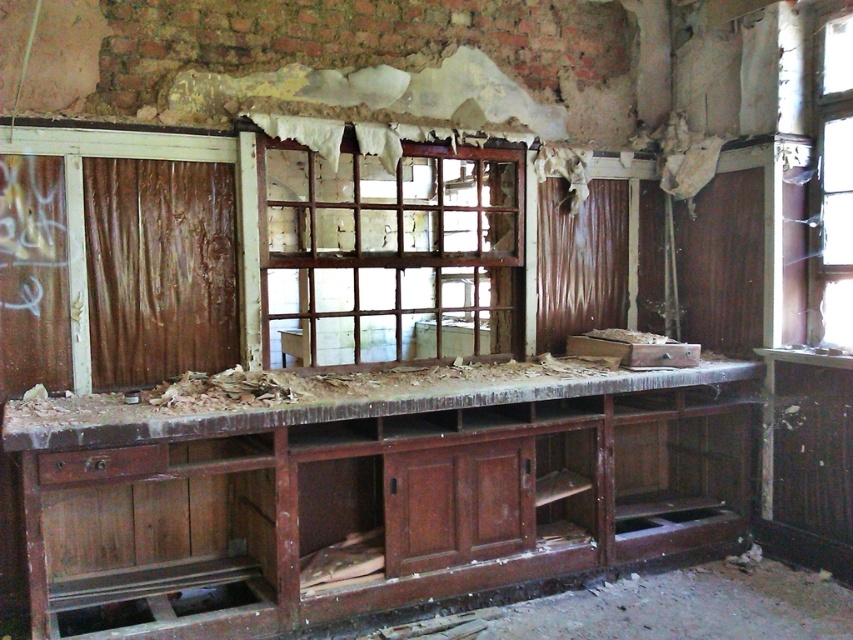
Question: Which object is closer to the camera taking this photo?

Choices:
 (A) transparent glass window at upper right
 (B) brown wooden window at center
 (C) rusty wood workbench at center
 (D) wooden debris at center

Answer: (D)

Question: Can you confirm if rusty wood workbench at center is positioned above wooden debris at center?

Choices:
 (A) no
 (B) yes

Answer: (A)

Question: Is brown wooden window at center to the left of transparent glass window at upper right from the viewer's perspective?

Choices:
 (A) yes
 (B) no

Answer: (A)

Question: Which point appears closest to the camera in this image?

Choices:
 (A) (833, 228)
 (B) (339, 276)
 (C) (149, 410)

Answer: (C)

Question: From the image, what is the correct spatial relationship of brown wooden window at center in relation to transparent glass window at upper right?

Choices:
 (A) left
 (B) right

Answer: (A)

Question: Which of the following is the farthest from the observer?

Choices:
 (A) transparent glass window at upper right
 (B) brown wooden window at center
 (C) rusty wood workbench at center
 (D) wooden debris at center

Answer: (B)